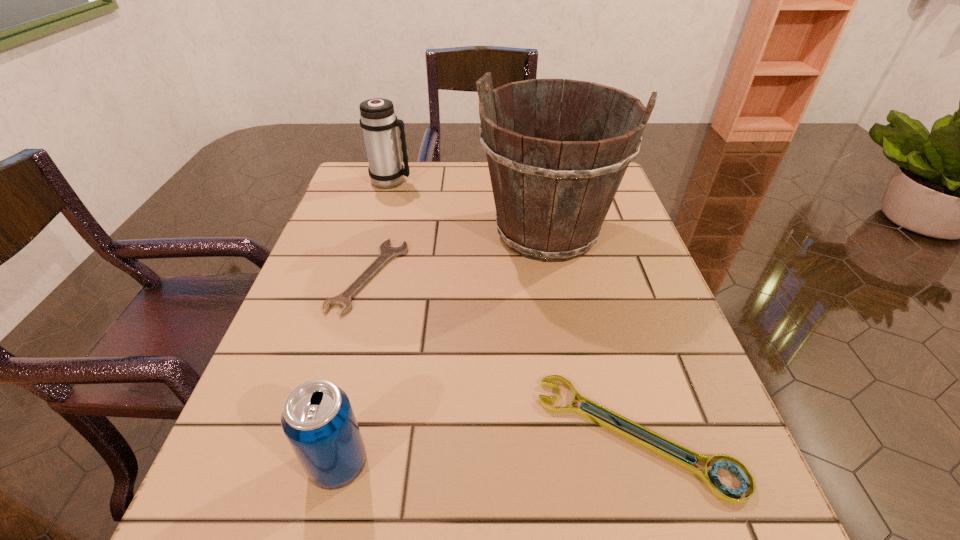
In order to click on object that is positioned at the far right corner in this screenshot , I will do `click(552, 195)`.

The image size is (960, 540). Find the location of `object that is at the near right corner`. object that is at the near right corner is located at coordinates (719, 490).

In the image, there is a desktop. Identify the location of vacant space at the near edge. (356, 526).

At what (x,y) coordinates should I click in order to perform the action: click on vacant space at the left edge. Please return your answer as a coordinate pair (x, y). The width and height of the screenshot is (960, 540). Looking at the image, I should click on (319, 327).

Identify the location of vacant region at the right edge. This screenshot has width=960, height=540. (587, 300).

I want to click on free space at the near right corner of the desktop, so (x=754, y=531).

Where is `vacant area that lies between the pop soda and the bucket`? vacant area that lies between the pop soda and the bucket is located at coordinates (443, 348).

You are a GUI agent. You are given a task and a screenshot of the screen. Output one action in this format:
    pyautogui.click(x=<x>, y=<y>)
    Task: Click on the free space between the left wrench and the pop soda
    This screenshot has height=540, width=960.
    Given the screenshot: What is the action you would take?
    pyautogui.click(x=353, y=370)

Identify the location of free point between the nearer wrench and the farthest object. The width and height of the screenshot is (960, 540). (514, 308).

Find the location of `free space between the bucket and the third shortest object`. free space between the bucket and the third shortest object is located at coordinates (443, 348).